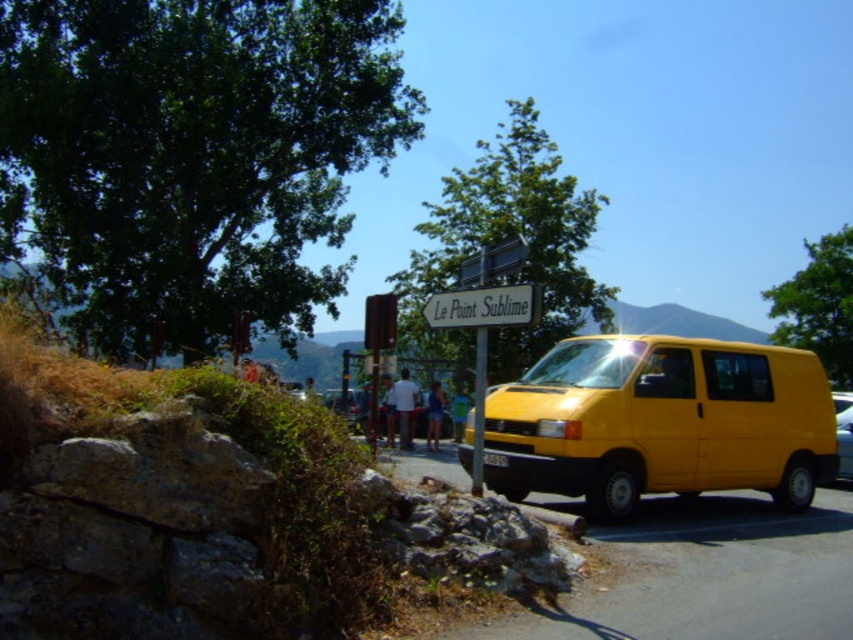
Question: Does yellow matte van at center have a lesser width compared to white plastic sign at center?

Choices:
 (A) yes
 (B) no

Answer: (A)

Question: Which object appears farthest from the camera in this image?

Choices:
 (A) yellow matte van at center
 (B) white matte shirt at center

Answer: (B)

Question: Considering the relative positions of white plastic sign at center and metallic silver sign at upper center in the image provided, where is white plastic sign at center located with respect to metallic silver sign at upper center?

Choices:
 (A) above
 (B) below

Answer: (B)

Question: Which of the following is the farthest from the observer?

Choices:
 (A) yellow matte van at center
 (B) metallic silver sign at upper center
 (C) white fabric shirt at center

Answer: (C)

Question: Which of the following is the closest to the observer?

Choices:
 (A) metallic silver sign at upper center
 (B) white fabric shirt at center
 (C) white matte shirt at center
 (D) yellow matte van at right

Answer: (A)

Question: Can you confirm if white plastic sign at center is wider than yellow matte van at right?

Choices:
 (A) no
 (B) yes

Answer: (A)